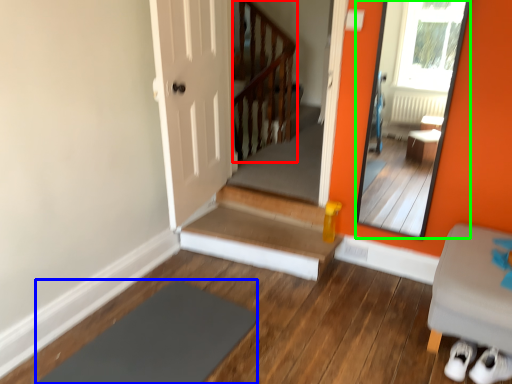
Question: Which object is positioned closest to balustrade (highlighted by a red box)? Select from slate (highlighted by a blue box) and mirror (highlighted by a green box).

Choices:
 (A) slate
 (B) mirror

Answer: (B)